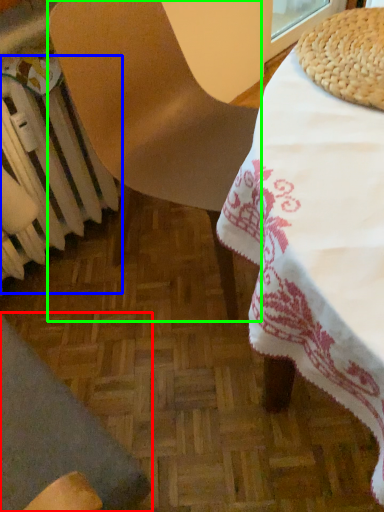
Question: Which object is positioned farthest from chair (highlighted by a red box)? Select from radiator (highlighted by a blue box) and chair (highlighted by a green box).

Choices:
 (A) radiator
 (B) chair

Answer: (B)